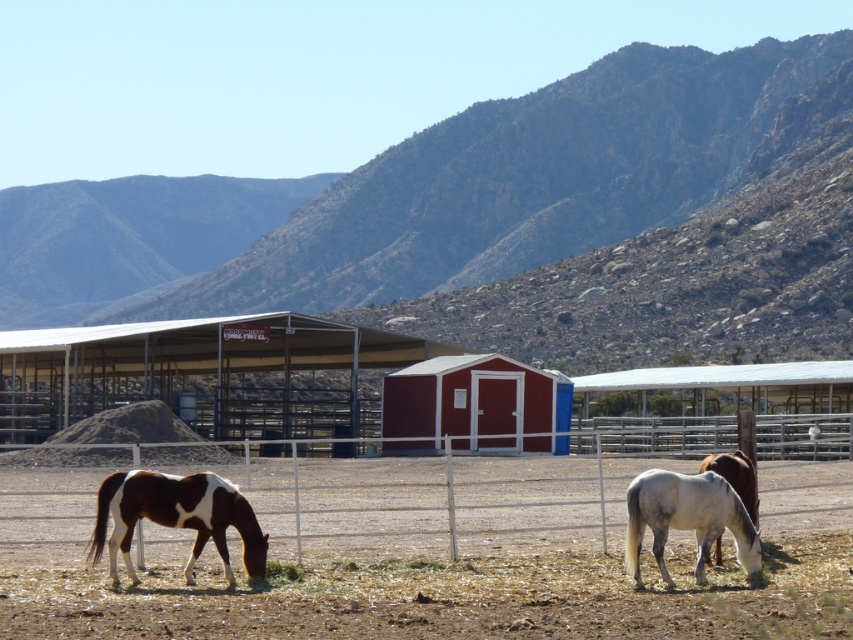
Is brown and white speckled horse at lower left bigger than white matte horse at lower right?

Correct, brown and white speckled horse at lower left is larger in size than white matte horse at lower right.

Does point (167, 508) come in front of point (637, 500)?

Yes, it is in front of point (637, 500).

You are a GUI agent. You are given a task and a screenshot of the screen. Output one action in this format:
    pyautogui.click(x=<x>, y=<y>)
    Task: Click on the brown and white speckled horse at lower left
    The height and width of the screenshot is (640, 853).
    Given the screenshot: What is the action you would take?
    pyautogui.click(x=175, y=516)

Measure the distance between rugged rock mountain at upper center and brown and white speckled horse at lower left.

The distance of rugged rock mountain at upper center from brown and white speckled horse at lower left is 86.47 meters.

Who is positioned more to the right, rugged rock mountain at upper center or brown and white speckled horse at lower left?

From the viewer's perspective, rugged rock mountain at upper center appears more on the right side.

Is point (844, 120) farther from viewer compared to point (218, 550)?

Yes.

In order to click on rugged rock mountain at upper center in this screenshot , I will do point(550,198).

Is point (555, 371) positioned after point (735, 515)?

That is True.

Who is higher up, smooth red shed at center or white matte horse at lower right?

white matte horse at lower right is higher up.

What do you see at coordinates (479, 403) in the screenshot?
I see `smooth red shed at center` at bounding box center [479, 403].

The width and height of the screenshot is (853, 640). Find the location of `smooth red shed at center`. smooth red shed at center is located at coordinates (479, 403).